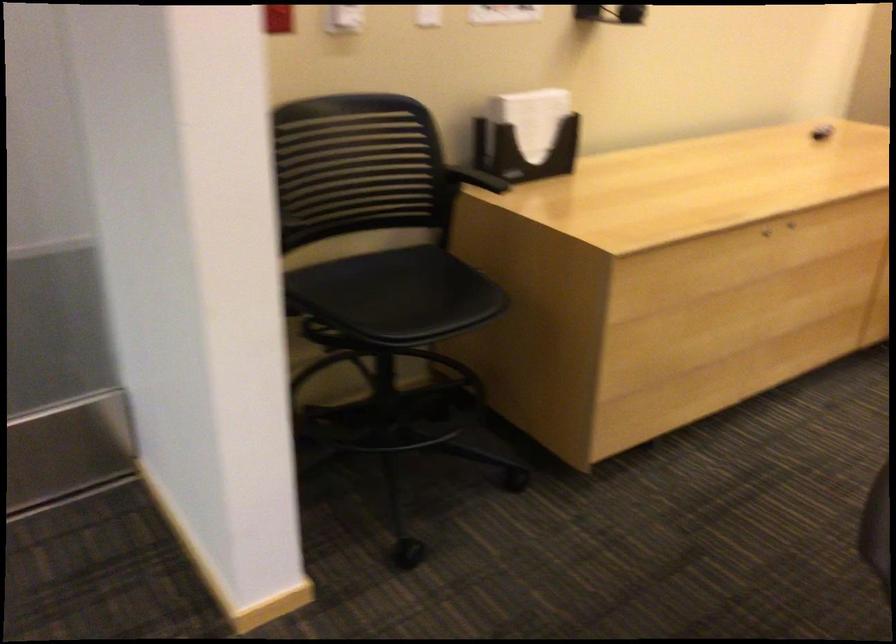
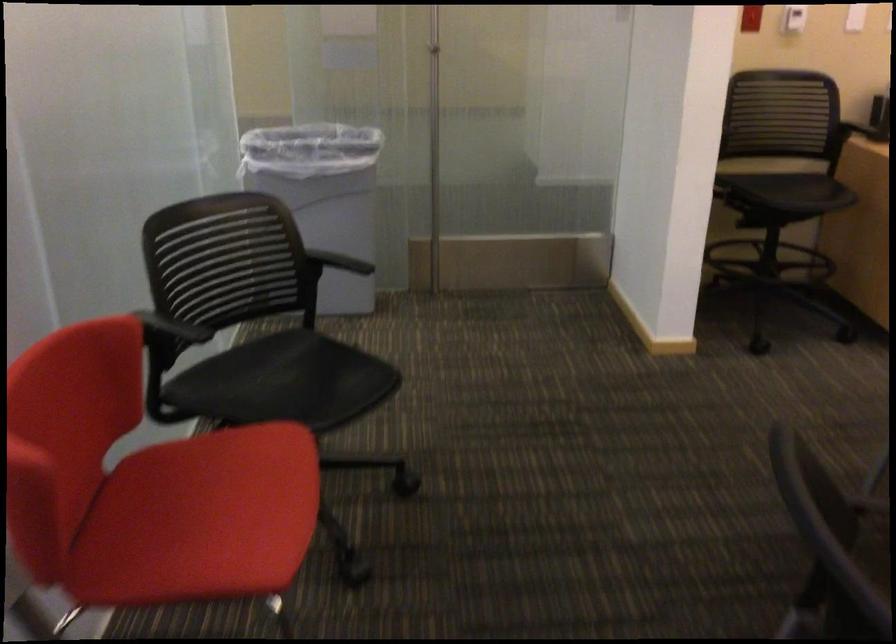
Locate, in the second image, the point that corresponds to pixel 468 193 in the first image.

(858, 131)